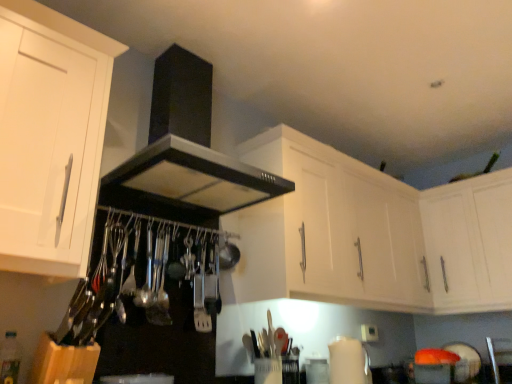
Question: From a real-world perspective, is white matte cabinet at upper right, which appears as the 3th cabinetry when viewed from the left, above or below white matte cabinet at left, the 3th cabinetry from the right?

Choices:
 (A) above
 (B) below

Answer: (B)

Question: Considering their positions, is white matte cabinet at upper right, which appears as the 3th cabinetry when viewed from the left, located in front of or behind white matte cabinet at left, the 3th cabinetry from the right?

Choices:
 (A) front
 (B) behind

Answer: (B)

Question: Based on their relative distances, which object is nearer to the white matte cabinet at left, which ranks as the first cabinetry in left-to-right order?

Choices:
 (A) satin nickel spatula at center
 (B) white matte cabinet at upper right, which appears as the 3th cabinetry when viewed from the left
 (C) black matte exhaust hood at upper center
 (D) white matte cabinet at upper center, placed as the second cabinetry when sorted from right to left

Answer: (C)

Question: Based on their relative distances, which object is farther from the white matte cabinet at upper right, the first cabinetry from the right?

Choices:
 (A) black matte exhaust hood at upper center
 (B) white matte cabinet at left, which ranks as the first cabinetry in left-to-right order
 (C) satin nickel spatula at center
 (D) white matte cabinet at upper center, placed as the second cabinetry when sorted from right to left

Answer: (B)